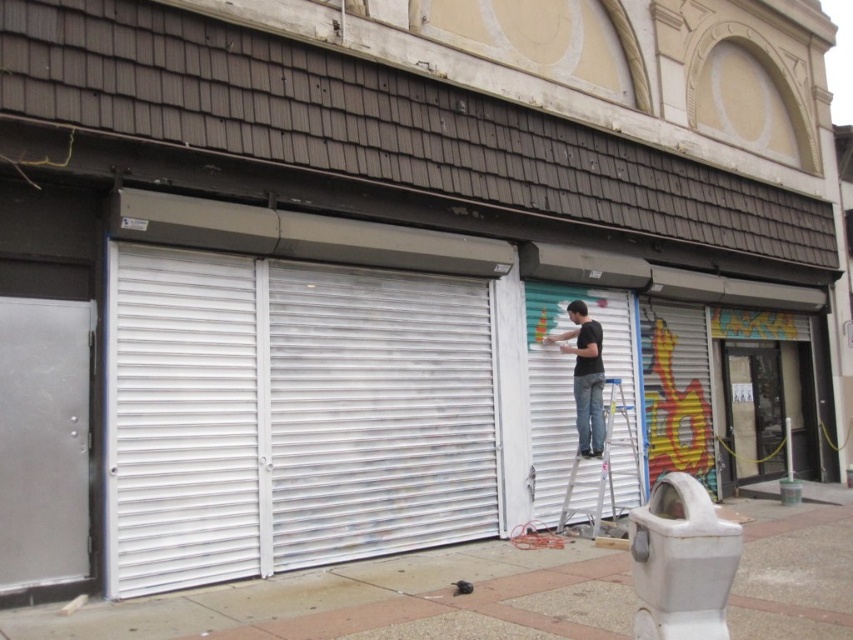
Who is more forward, (x=469, y=365) or (x=158, y=400)?

Positioned in front is point (x=158, y=400).

Locate an element on the screen. white corrugated metal at left is located at coordinates (292, 417).

Is point (74, 516) behind point (622, 435)?

No.

Does brushed metal garage door at left appear on the right side of metallic silver ladder at center?

In fact, brushed metal garage door at left is to the left of metallic silver ladder at center.

Does point (38, 298) lie in front of point (611, 440)?

That is True.

Locate an element on the screen. This screenshot has height=640, width=853. brushed metal garage door at left is located at coordinates (44, 442).

Who is more distant from viewer, (704,449) or (561,520)?

The point (704,449) is more distant.

Who is higher up, multicolored painted metal shutter at right or metallic silver ladder at center?

multicolored painted metal shutter at right is higher up.

At what (x,y) coordinates should I click in order to perform the action: click on multicolored painted metal shutter at right. Please return your answer as a coordinate pair (x, y). The height and width of the screenshot is (640, 853). Looking at the image, I should click on (676, 392).